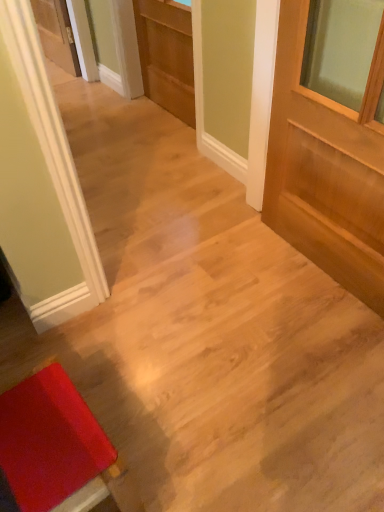
Question: Is light brown wood door at right, the first door when ordered from front to back, facing away from rubberized red stool at lower left?

Choices:
 (A) no
 (B) yes

Answer: (A)

Question: Is light brown wood door at right, which is counted as the second door, starting from the top, taller than rubberized red stool at lower left?

Choices:
 (A) no
 (B) yes

Answer: (B)

Question: From the image's perspective, is light brown wood door at right, the first door when ordered from front to back, located above rubberized red stool at lower left?

Choices:
 (A) yes
 (B) no

Answer: (A)

Question: Is light brown wood door at right, which ranks as the 2th door in back-to-front order, next to rubberized red stool at lower left and touching it?

Choices:
 (A) no
 (B) yes

Answer: (A)

Question: Is rubberized red stool at lower left completely or partially inside light brown wood door at right, the first door when ordered from front to back?

Choices:
 (A) no
 (B) yes

Answer: (A)

Question: Looking at their shapes, would you say light brown wood door at right, which ranks as the 2th door in back-to-front order, is wider or thinner than light brown wood door at center, arranged as the 1th door when viewed from the left?

Choices:
 (A) thin
 (B) wide

Answer: (B)

Question: From a real-world perspective, is light brown wood door at right, which ranks as the 2th door in back-to-front order, positioned above or below light brown wood door at center, which ranks as the 2th door in right-to-left order?

Choices:
 (A) above
 (B) below

Answer: (A)

Question: Would you say light brown wood door at right, which appears as the second door when viewed from the left, is to the left or to the right of light brown wood door at center, arranged as the 1th door when viewed from the back, in the picture?

Choices:
 (A) left
 (B) right

Answer: (B)

Question: Does point (332, 150) appear closer or farther from the camera than point (142, 33)?

Choices:
 (A) farther
 (B) closer

Answer: (B)

Question: Considering the positions of rubberized red stool at lower left and light brown wood door at right, which is counted as the second door, starting from the top, in the image, is rubberized red stool at lower left taller or shorter than light brown wood door at right, which is counted as the second door, starting from the top,?

Choices:
 (A) tall
 (B) short

Answer: (B)

Question: From a real-world perspective, is rubberized red stool at lower left physically located above or below light brown wood door at right, which ranks as the 2th door in back-to-front order?

Choices:
 (A) above
 (B) below

Answer: (B)

Question: From the image's perspective, is rubberized red stool at lower left located above or below light brown wood door at right, which appears as the second door when viewed from the left?

Choices:
 (A) below
 (B) above

Answer: (A)

Question: In the image, is rubberized red stool at lower left positioned in front of or behind light brown wood door at right, the first door when ordered from front to back?

Choices:
 (A) behind
 (B) front

Answer: (B)

Question: Is light brown wood door at center, arranged as the 1th door when viewed from the left, taller or shorter than rubberized red stool at lower left?

Choices:
 (A) short
 (B) tall

Answer: (B)

Question: From a real-world perspective, is light brown wood door at center, the second door from the bottom, above or below rubberized red stool at lower left?

Choices:
 (A) above
 (B) below

Answer: (A)